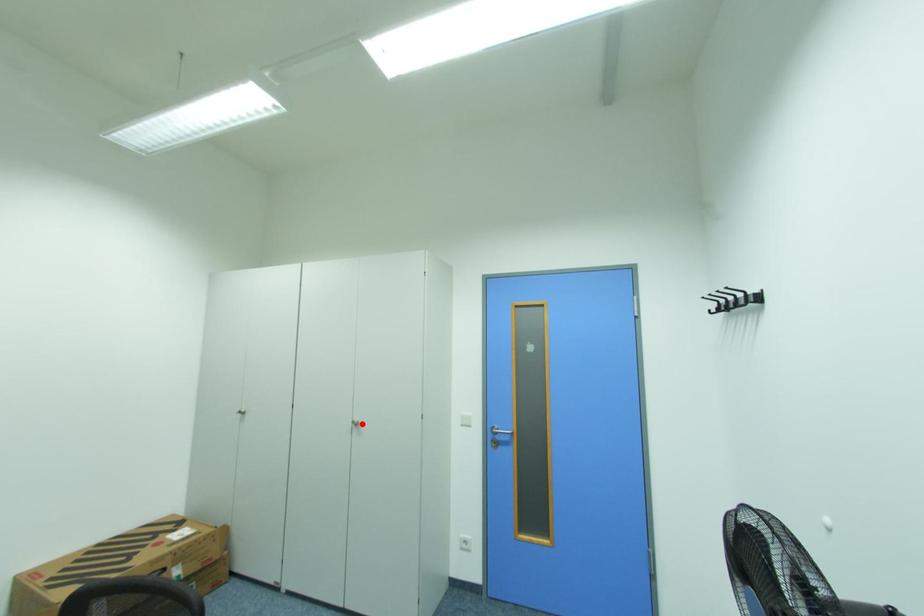
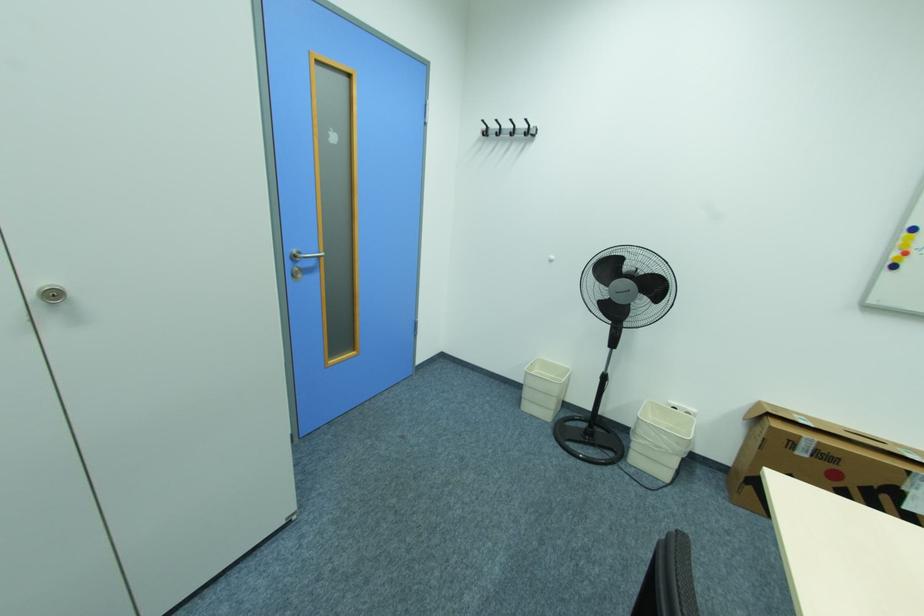
In the second image, find the point that corresponds to the highlighted location in the first image.

(64, 294)